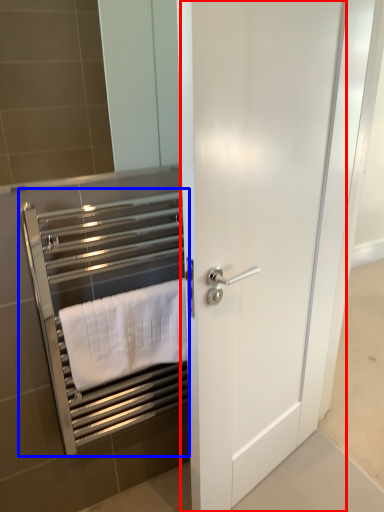
Question: Which object appears closest to the camera in this image, door (highlighted by a red box) or closet (highlighted by a blue box)?

Choices:
 (A) door
 (B) closet

Answer: (A)